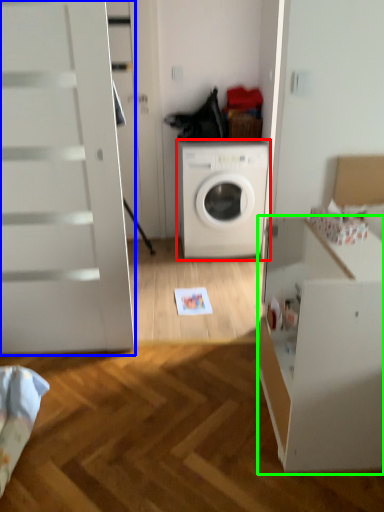
Question: Which object is positioned farthest from washing machine (highlighted by a red box)? Select from screen door (highlighted by a blue box) and file cabinet (highlighted by a green box).

Choices:
 (A) screen door
 (B) file cabinet

Answer: (B)